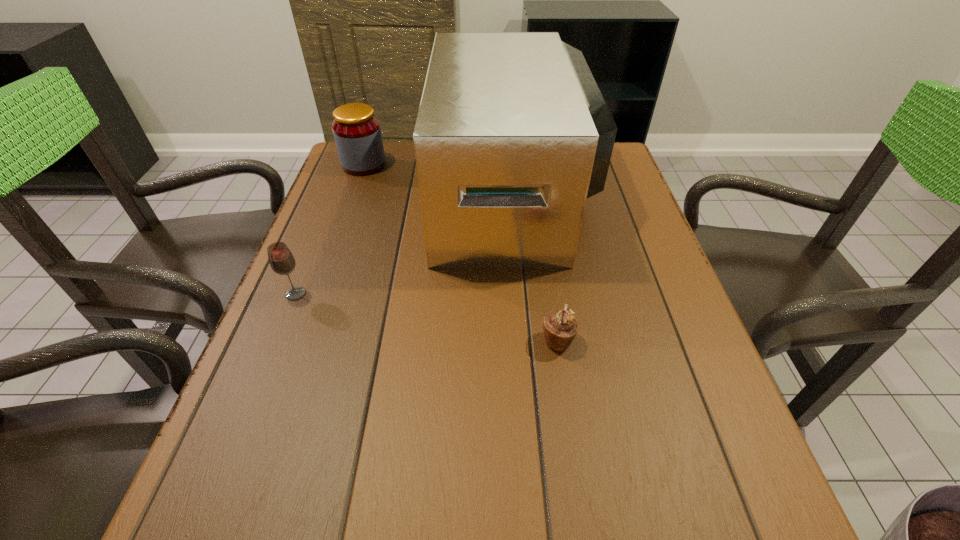
Where is `microwave oven`? The image size is (960, 540). microwave oven is located at coordinates (512, 136).

Identify the location of jar. The width and height of the screenshot is (960, 540). (356, 130).

You are a GUI agent. You are given a task and a screenshot of the screen. Output one action in this format:
    pyautogui.click(x=<x>, y=<y>)
    Task: Click on the third farthest object
    This screenshot has width=960, height=540.
    Given the screenshot: What is the action you would take?
    pyautogui.click(x=282, y=262)

You are a GUI agent. You are given a task and a screenshot of the screen. Output one action in this format:
    pyautogui.click(x=<x>, y=<y>)
    Task: Click on the third tallest object
    
    Given the screenshot: What is the action you would take?
    pyautogui.click(x=282, y=262)

I want to click on muffin, so click(560, 327).

The image size is (960, 540). Find the location of `the nearest object`. the nearest object is located at coordinates (560, 327).

The height and width of the screenshot is (540, 960). Find the location of `free space located on the front-facing side of the microwave oven`. free space located on the front-facing side of the microwave oven is located at coordinates (379, 195).

This screenshot has height=540, width=960. Identify the location of vacant area situated 0.100m on the front-facing side of the microwave oven. (400, 195).

Find the location of `free space located on the front-facing side of the microwave oven`. free space located on the front-facing side of the microwave oven is located at coordinates (368, 195).

You are a GUI agent. You are given a task and a screenshot of the screen. Output one action in this format:
    pyautogui.click(x=<x>, y=<y>)
    Task: Click on the free space located on the right of the third shortest object
    The width and height of the screenshot is (960, 540).
    Given the screenshot: What is the action you would take?
    pyautogui.click(x=402, y=165)